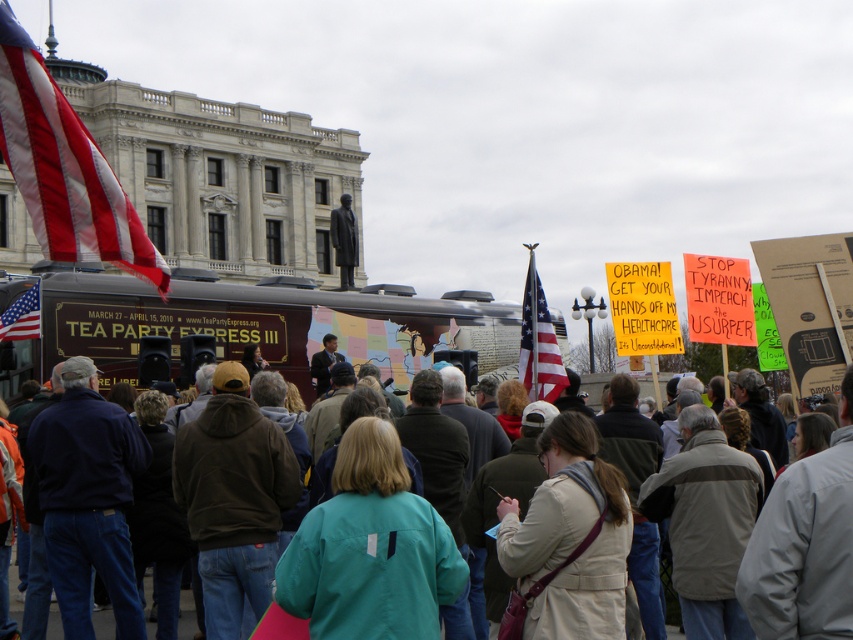
You are standing at the point marked as point (427, 554) in the image. The speaker on stage is 50 meters away from you. Can you see the speaker clearly from your current position?

The distance of point (427, 554) from viewer is 55.86 meters. Since the speaker is 50 meters away from you, you are actually 5.86 meters behind the speaker, which means you cannot see the speaker clearly from your current position.

You are a photographer positioned at the back of the crowd. You want to take a photo of the teal fabric jacket at center without the brown vinyl food truck at center blocking it. Is this possible?

The brown vinyl food truck at center is further to the viewer than the teal fabric jacket at center, so the food truck is closer to you. Therefore, it will block your view of the teal fabric jacket at center. You cannot take a photo without the food truck blocking it.

You are a photographer at the rally and want to capture a closeup of the tan leather jacket at center. According to the coordinates provided, where should you aim your camera?

You should aim your camera at point (570, 538) to capture the tan leather jacket at center.